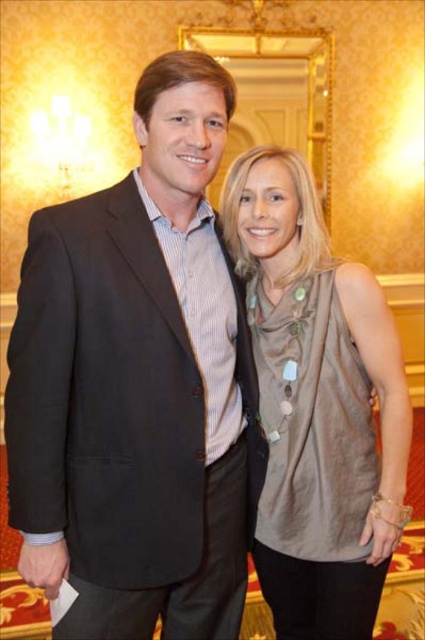
Image resolution: width=425 pixels, height=640 pixels. What do you see at coordinates (138, 385) in the screenshot?
I see `matte black suit at left` at bounding box center [138, 385].

Between matte black suit at left and satin beige top at center, which one has more height?

With more height is matte black suit at left.

Find the location of a particular element. matte black suit at left is located at coordinates (138, 385).